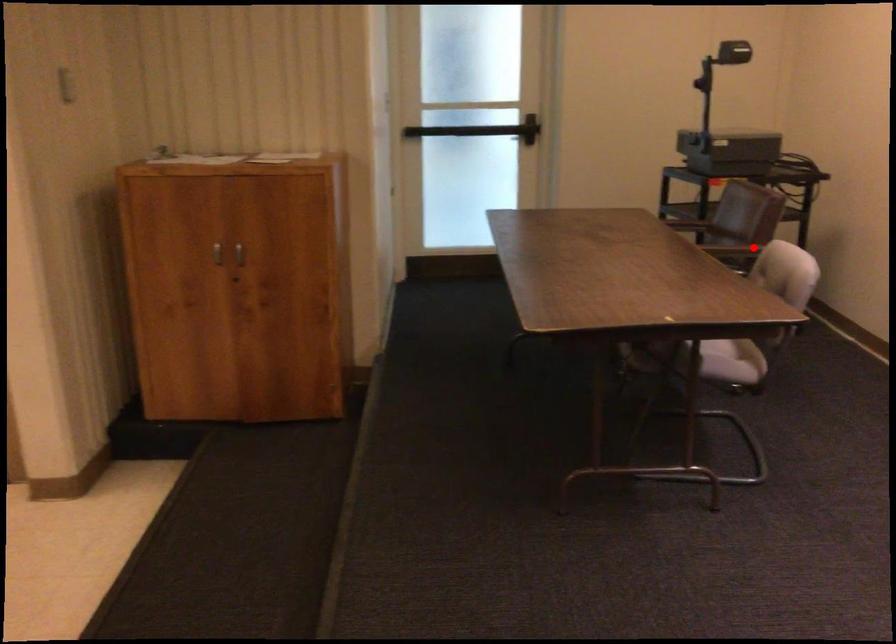
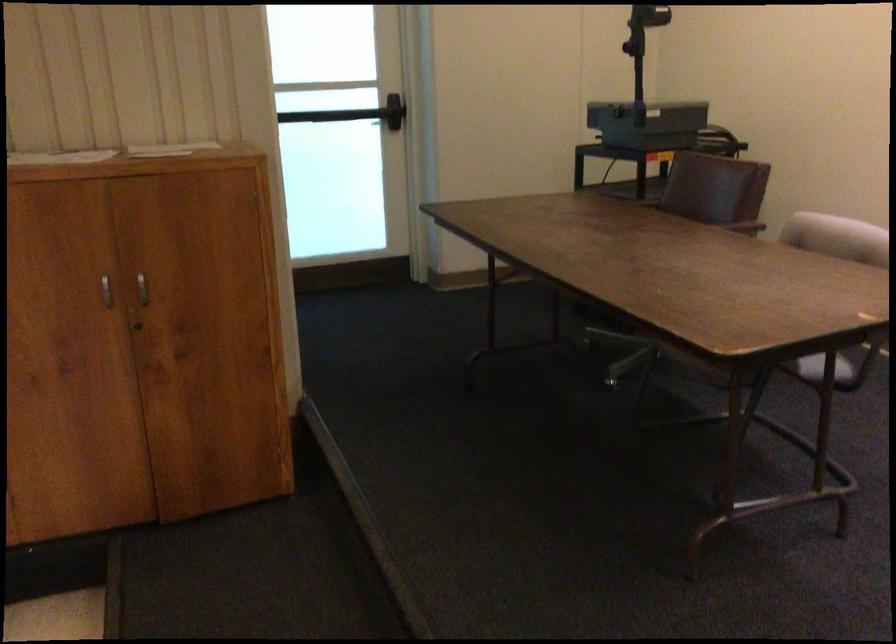
In the second image, find the point that corresponds to the highlighted location in the first image.

(739, 223)